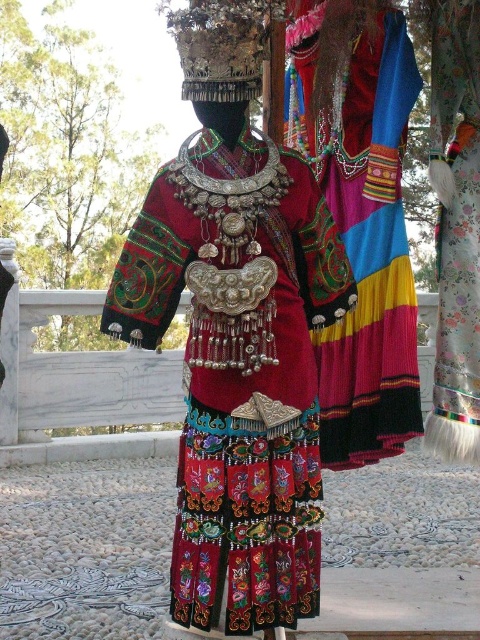
You are a fashion designer who wants to take a closer look at the velvet embroidered dress at center. If you are currently standing 6 feet away from it, can you walk forward to get a better view without stepping over the 2 feet safety distance rule?

The velvet embroidered dress at center is 5.06 feet away from the camera. Since you are standing 6 feet away, you can walk forward 0.94 feet to be 5.06 feet away, which is within the 2 feet safety distance requirement. Therefore, you can move closer to examine the dress.

You are a fashion designer examining the traditional outfit displayed on the mannequin. You notice two skirts, the embroidered silk skirt at center and the velvet floral skirt at center. Which one is positioned higher on the mannequin?

The embroidered silk skirt at center is located above the velvet floral skirt at center, so it is positioned higher on the mannequin.